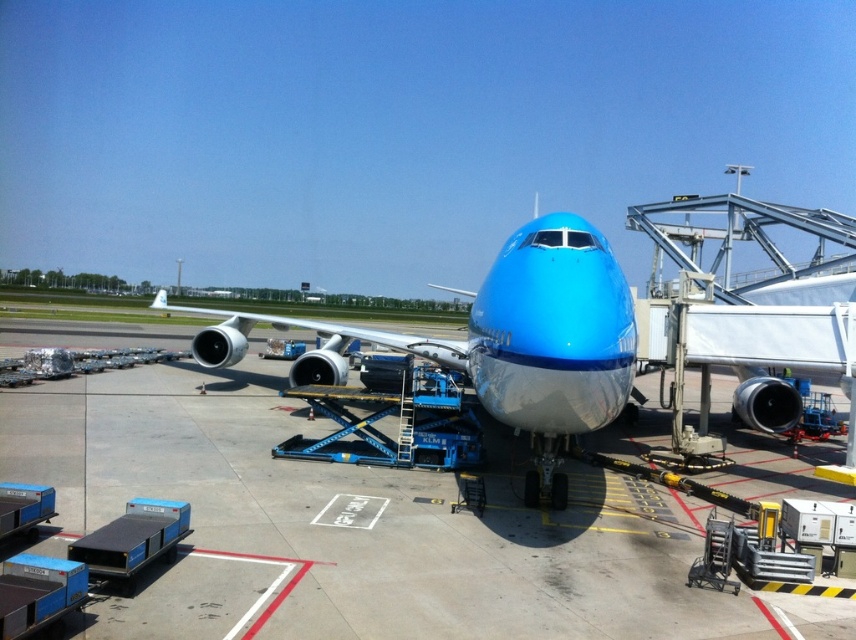
You are a maintenance worker with a 3.0 meter ladder. You need to reach the underside of the matte blue airplane at center from the matte gray tarmac at center. Is your ladder long enough to span the gap between them?

The matte gray tarmac at center and matte blue airplane at center are 3.19 meters apart. Since the ladder is only 3.0 meters long, it is not long enough to span the gap between them.

You are standing at the airport gate and see the KLM Royal Dutch Airlines airplane. There is a point marked at coordinates point (x=363, y=528). What is the material of the surface at this point?

The point (x=363, y=528) corresponds to matte gray tarmac at center, so the material is matte gray tarmac.